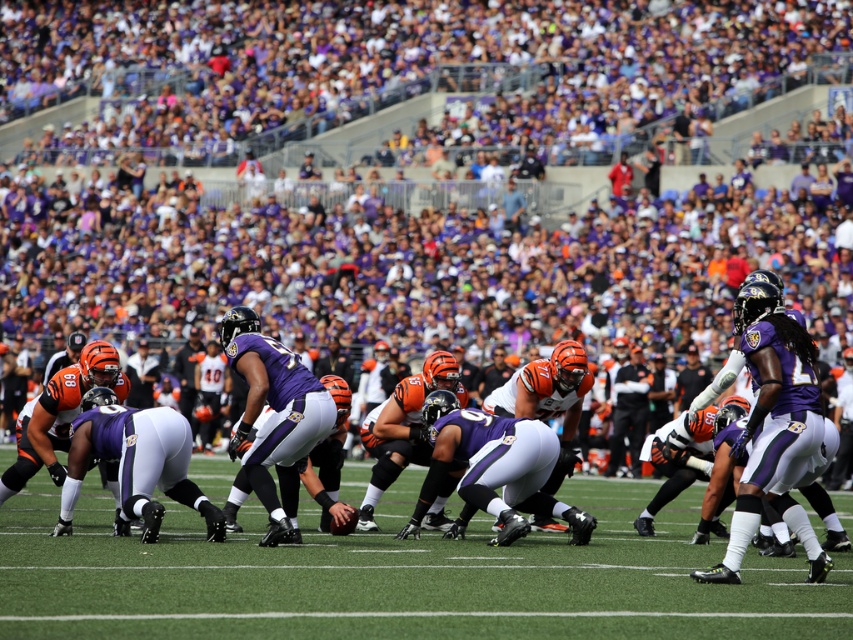
Question: Among these points, which one is farthest from the camera?

Choices:
 (A) (450, 493)
 (B) (563, 490)

Answer: (B)

Question: Which of the following is the closest to the observer?

Choices:
 (A) green artificial turf at center
 (B) purple matte jersey at center

Answer: (A)

Question: Can you confirm if purple matte jersey at center is bigger than green artificial turf at center?

Choices:
 (A) yes
 (B) no

Answer: (A)

Question: Observing the image, what is the correct spatial positioning of purple matte jersey at center in reference to green artificial turf at center?

Choices:
 (A) above
 (B) below

Answer: (A)

Question: Considering the relative positions of purple matte jersey at center and green artificial turf at center in the image provided, where is purple matte jersey at center located with respect to green artificial turf at center?

Choices:
 (A) left
 (B) right

Answer: (A)

Question: Which object appears farthest from the camera in this image?

Choices:
 (A) green artificial turf at center
 (B) purple matte jersey at center

Answer: (B)